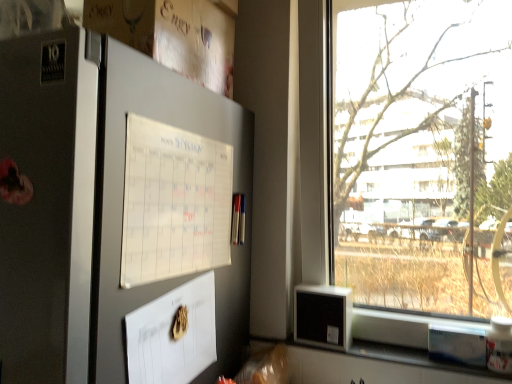
Question: Considering the relative sizes of white paper calendar at upper left and transparent glass window at right in the image provided, is white paper calendar at upper left taller than transparent glass window at right?

Choices:
 (A) no
 (B) yes

Answer: (A)

Question: Would you say white paper calendar at upper left is outside transparent glass window at right?

Choices:
 (A) yes
 (B) no

Answer: (A)

Question: Does white paper calendar at upper left have a larger size compared to transparent glass window at right?

Choices:
 (A) yes
 (B) no

Answer: (B)

Question: From a real-world perspective, is white paper calendar at upper left positioned under transparent glass window at right based on gravity?

Choices:
 (A) yes
 (B) no

Answer: (A)

Question: From the image's perspective, is white paper calendar at upper left located beneath transparent glass window at right?

Choices:
 (A) yes
 (B) no

Answer: (A)

Question: Considering their positions, is white paper calendar at upper left located in front of or behind transparent glass window at right?

Choices:
 (A) behind
 (B) front

Answer: (B)

Question: From a real-world perspective, relative to transparent glass window at right, is white paper calendar at upper left vertically above or below?

Choices:
 (A) above
 (B) below

Answer: (B)

Question: In the image, is white paper calendar at upper left on the left side or the right side of transparent glass window at right?

Choices:
 (A) right
 (B) left

Answer: (B)

Question: Is point (141, 152) closer or farther from the camera than point (391, 276)?

Choices:
 (A) farther
 (B) closer

Answer: (B)

Question: From a real-world perspective, is satin silver fridge at left above or below transparent glass window at right?

Choices:
 (A) above
 (B) below

Answer: (B)

Question: Is satin silver fridge at left wider or thinner than transparent glass window at right?

Choices:
 (A) wide
 (B) thin

Answer: (A)

Question: From the image's perspective, relative to transparent glass window at right, is satin silver fridge at left above or below?

Choices:
 (A) above
 (B) below

Answer: (B)

Question: Based on their positions, is satin silver fridge at left located to the left or right of transparent glass window at right?

Choices:
 (A) right
 (B) left

Answer: (B)

Question: Based on their positions, is white paper calendar at upper left located to the left or right of satin silver fridge at left?

Choices:
 (A) right
 (B) left

Answer: (A)

Question: From the image's perspective, is white paper calendar at upper left positioned above or below satin silver fridge at left?

Choices:
 (A) above
 (B) below

Answer: (A)